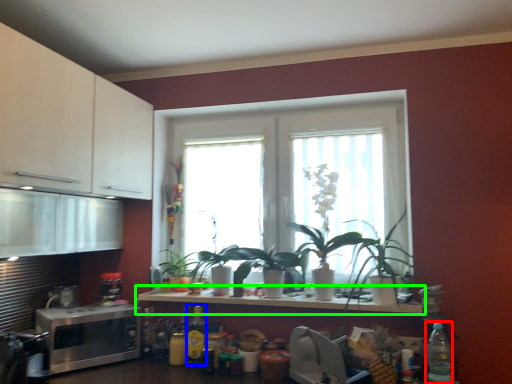
Question: Based on their relative distances, which object is nearer to bottle (highlighted by a red box)? Choose from bottle (highlighted by a blue box) and countertop (highlighted by a green box).

Choices:
 (A) bottle
 (B) countertop

Answer: (B)